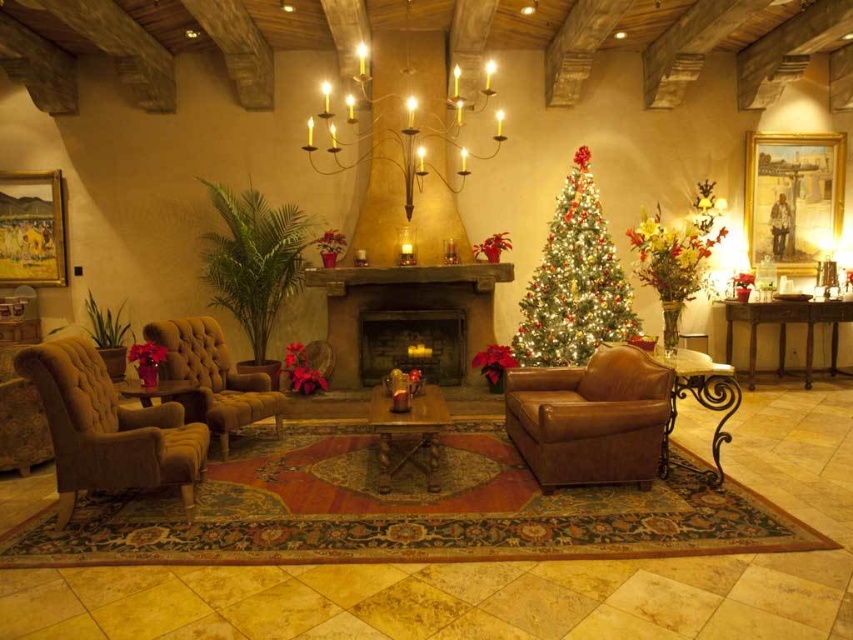
Question: Which point is closer to the camera?

Choices:
 (A) velvet brown armchair at left
 (B) wooden table at center
 (C) rustic stone fireplace at center
 (D) dark stone fireplace at center

Answer: (A)

Question: Does rustic stone fireplace at center come in front of velvet brown couch at left?

Choices:
 (A) no
 (B) yes

Answer: (A)

Question: Which point appears closest to the camera in this image?

Choices:
 (A) (106, 403)
 (B) (355, 326)

Answer: (A)

Question: Can you confirm if velvet brown armchair at left is thinner than brown leather side table at right?

Choices:
 (A) yes
 (B) no

Answer: (A)

Question: Which of these objects is positioned farthest from the velvet brown armchair at left?

Choices:
 (A) velvet brown couch at left
 (B) dark stone fireplace at center
 (C) brown leather couch at center
 (D) brown leather side table at right

Answer: (D)

Question: Is rustic stone fireplace at center thinner than velvet brown couch at left?

Choices:
 (A) no
 (B) yes

Answer: (A)